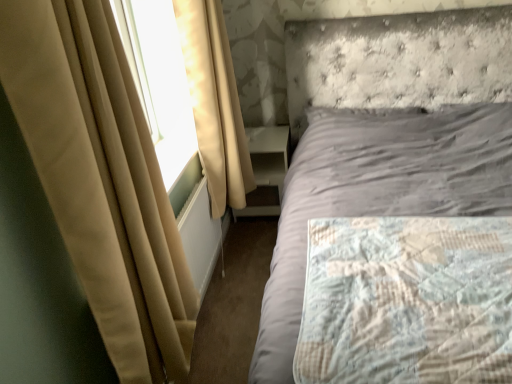
Question: Is beige fabric curtain at left, placed as the first curtain when sorted from front to back, positioned with its back to quilted fabric mattress at right?

Choices:
 (A) yes
 (B) no

Answer: (B)

Question: From the image's perspective, does beige fabric curtain at left, placed as the first curtain when sorted from front to back, appear lower than quilted fabric mattress at right?

Choices:
 (A) no
 (B) yes

Answer: (A)

Question: Does beige fabric curtain at left, which is the 2th curtain from back to front, lie behind quilted fabric mattress at right?

Choices:
 (A) no
 (B) yes

Answer: (A)

Question: Does beige fabric curtain at left, which is the 2th curtain from back to front, have a smaller size compared to quilted fabric mattress at right?

Choices:
 (A) yes
 (B) no

Answer: (B)

Question: Considering the relative sizes of beige fabric curtain at left, which is the 2th curtain from back to front, and quilted fabric mattress at right in the image provided, is beige fabric curtain at left, which is the 2th curtain from back to front, wider than quilted fabric mattress at right?

Choices:
 (A) no
 (B) yes

Answer: (A)

Question: From the image's perspective, is white plastic radiator at lower left above or below quilted fabric mattress at right?

Choices:
 (A) below
 (B) above

Answer: (B)

Question: In the image, is white plastic radiator at lower left on the left side or the right side of quilted fabric mattress at right?

Choices:
 (A) right
 (B) left

Answer: (B)

Question: In terms of size, does white plastic radiator at lower left appear bigger or smaller than quilted fabric mattress at right?

Choices:
 (A) small
 (B) big

Answer: (A)

Question: Is white plastic radiator at lower left wider or thinner than quilted fabric mattress at right?

Choices:
 (A) thin
 (B) wide

Answer: (A)

Question: Considering the positions of quilted fabric mattress at right and white plastic radiator at lower left in the image, is quilted fabric mattress at right bigger or smaller than white plastic radiator at lower left?

Choices:
 (A) big
 (B) small

Answer: (A)

Question: In terms of height, does quilted fabric mattress at right look taller or shorter compared to white plastic radiator at lower left?

Choices:
 (A) tall
 (B) short

Answer: (B)

Question: Choose the correct answer: Is quilted fabric mattress at right inside white plastic radiator at lower left or outside it?

Choices:
 (A) outside
 (B) inside

Answer: (A)

Question: From the image's perspective, relative to white plastic radiator at lower left, is quilted fabric mattress at right above or below?

Choices:
 (A) below
 (B) above

Answer: (A)

Question: In terms of width, does white glossy nightstand at center look wider or thinner when compared to beige fabric curtain at left, the second curtain from the front?

Choices:
 (A) thin
 (B) wide

Answer: (B)

Question: Is white glossy nightstand at center inside the boundaries of beige fabric curtain at left, the second curtain from the front, or outside?

Choices:
 (A) inside
 (B) outside

Answer: (B)